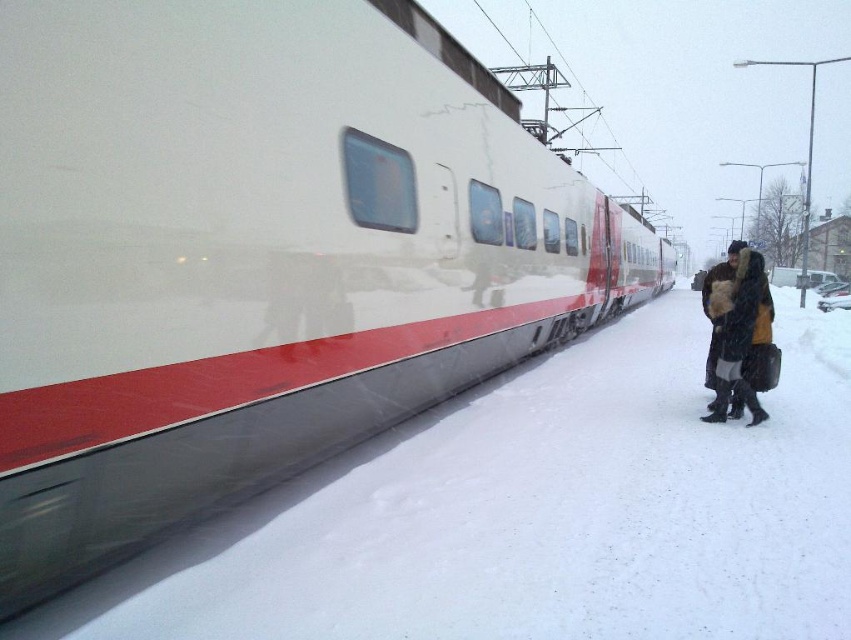
You are a passenger on the high speed train and you see the point marked at coordinate (535, 513). What is the object at that point?

The object at coordinate (535, 513) is white powdery snow at lower left.